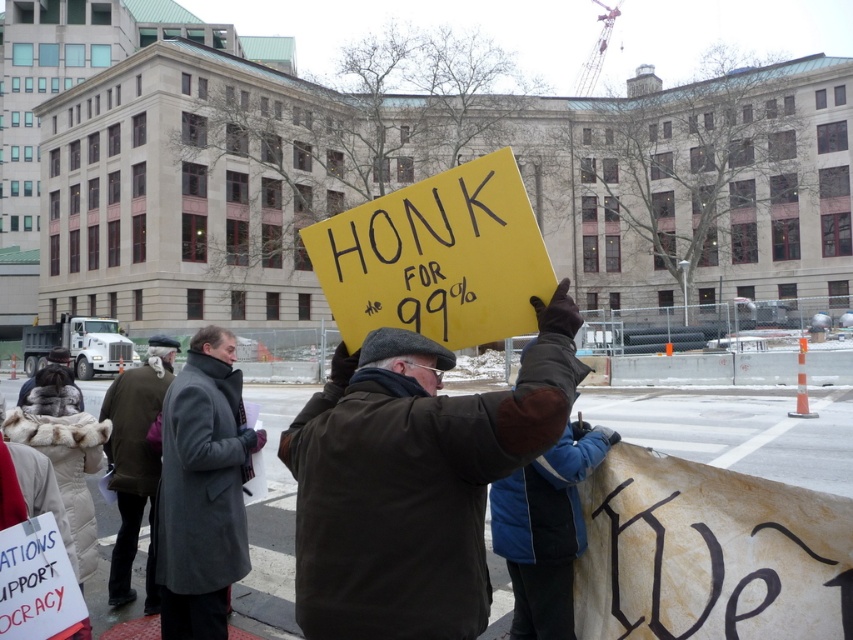
Question: Considering the real-world distances, which object is farthest from the yellow paper sign at center?

Choices:
 (A) gray wool coat at center
 (B) dark brown leather jacket at center
 (C) dark brown wool coat at center

Answer: (C)

Question: Is gray wool coat at center in front of dark brown wool coat at center?

Choices:
 (A) no
 (B) yes

Answer: (B)

Question: Does dark brown leather jacket at center have a lesser width compared to gray wool coat at center?

Choices:
 (A) yes
 (B) no

Answer: (B)

Question: Is dark brown leather jacket at center bigger than dark brown wool coat at center?

Choices:
 (A) no
 (B) yes

Answer: (A)

Question: Based on their relative distances, which object is nearer to the dark brown leather jacket at center?

Choices:
 (A) dark brown wool coat at center
 (B) gray wool coat at center

Answer: (B)

Question: Among these points, which one is nearest to the camera?

Choices:
 (A) pyautogui.click(x=132, y=486)
 (B) pyautogui.click(x=469, y=416)
 (C) pyautogui.click(x=170, y=525)

Answer: (B)